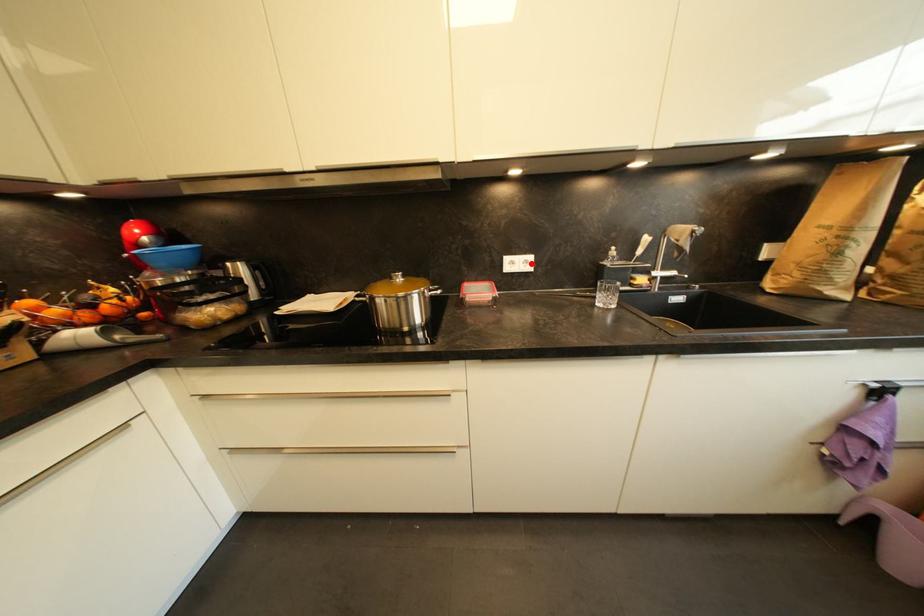
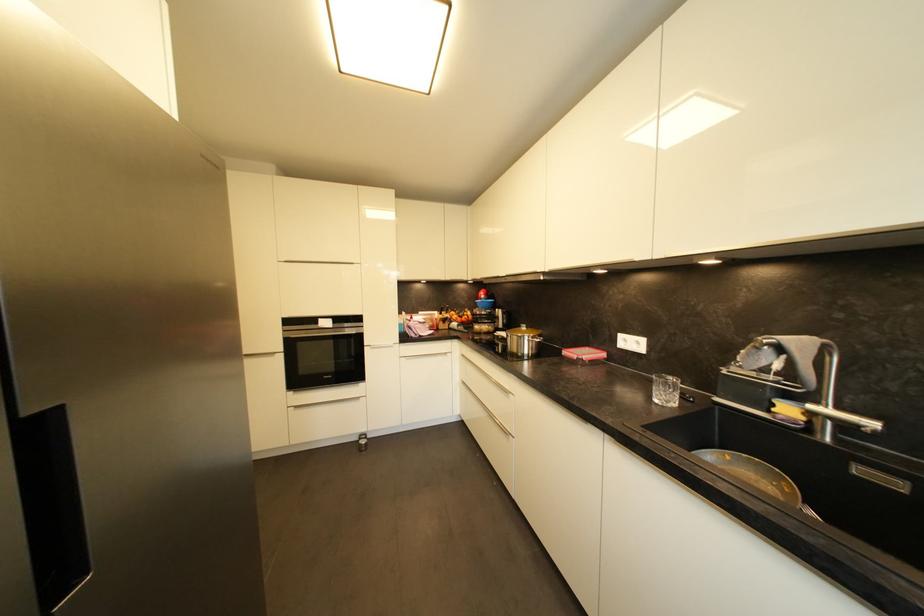
Find the pixel in the second image that matches the highlighted location in the first image.

(642, 345)